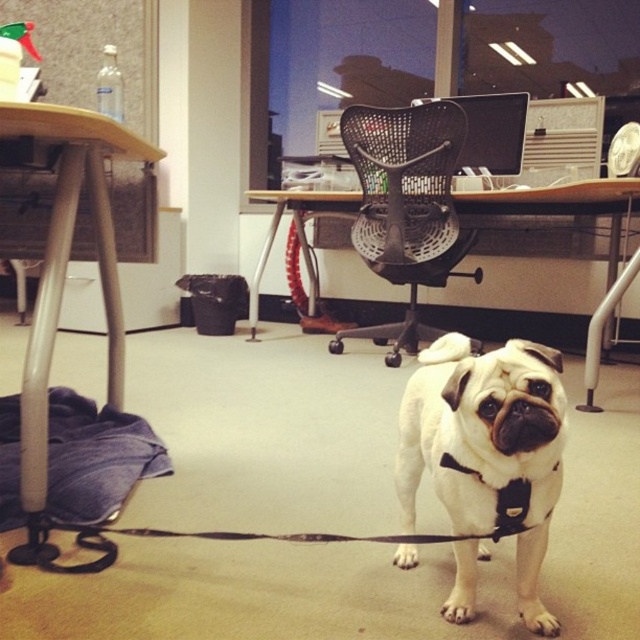
In the scene shown: You are a delivery robot that is 0.8 meters wide. You need to move from the door on the left to the desk on the right in the office. There is a white fur dog at center and a black mesh chair at center in your path. Can you pass between them without hitting either?

The distance between the white fur dog at center and the black mesh chair at center is 1.69 meters. Since the robot is 0.8 meters wide, it can safely pass through the gap as the available space is wider than the robot.

You are organizing a photo shoot in this office and want to position the white fur dog at center so that it faces away from the wooden desk at left. Which direction should the dog face?

The white fur dog at center is to the right of the wooden desk at left, so it should face to the right to be facing away from the wooden desk at left.